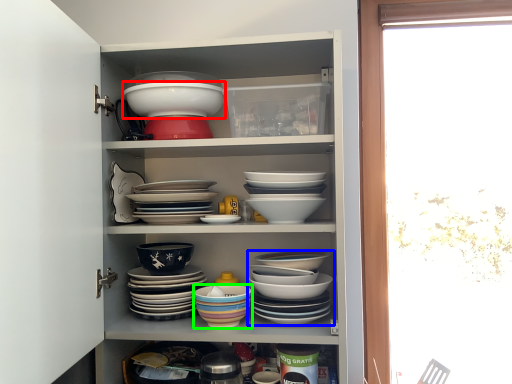
Question: Considering the real-world distances, which object is closest to bowl (highlighted by a red box)? bowl (highlighted by a blue box) or bowl (highlighted by a green box).

Choices:
 (A) bowl
 (B) bowl

Answer: (B)